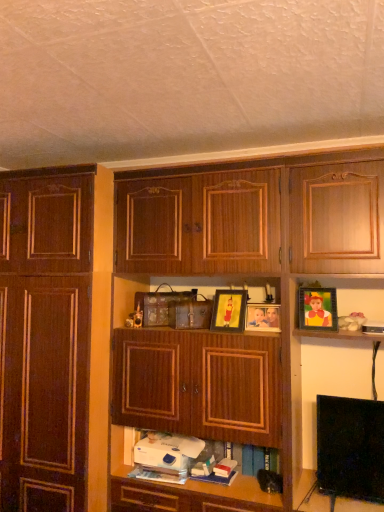
Question: In the image, is wooden cabinet at center, arranged as the second cabinetry when viewed from the left, positioned in front of or behind dark wood cabinet at left, the 1th cabinetry when ordered from left to right?

Choices:
 (A) front
 (B) behind

Answer: (A)

Question: Is wooden cabinet at center, the 1th cabinetry from the right, wider or thinner than dark wood cabinet at left, acting as the 2th cabinetry starting from the right?

Choices:
 (A) thin
 (B) wide

Answer: (A)

Question: Based on their relative distances, which object is farther from the wooden photo frame at center, which is the 2th picture frame in right-to-left order?

Choices:
 (A) matte wooden picture frame at center, acting as the third picture frame starting from the right
 (B) dark wood cabinet at left, acting as the 2th cabinetry starting from the right
 (C) white matte book at center, positioned as the 1th book in right-to-left order
 (D) metallic gold picture frame at upper right, which is the 3th picture frame from left to right
 (E) white matte book at lower center, the 1th book from the left

Answer: (B)

Question: Estimate the real-world distances between objects in this image. Which object is closer to the white matte book at lower center, the 1th book from the left?

Choices:
 (A) metallic gold picture frame at upper right, which is the 3th picture frame from left to right
 (B) matte wooden picture frame at center, acting as the third picture frame starting from the right
 (C) white matte book at center, the second book in the left-to-right sequence
 (D) wooden photo frame at center, which is the 2th picture frame in right-to-left order
 (E) dark wood cabinet at left, the 1th cabinetry when ordered from left to right

Answer: (C)